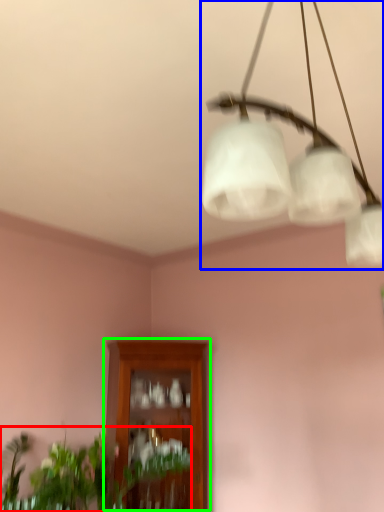
Question: Which is farther away from houseplant (highlighted by a red box)? lamp (highlighted by a blue box) or cabinetry (highlighted by a green box)?

Choices:
 (A) lamp
 (B) cabinetry

Answer: (A)